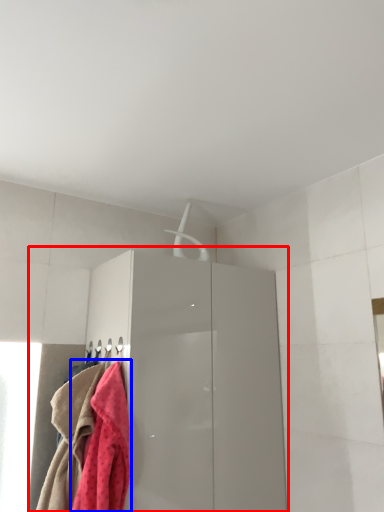
Question: Which object appears farthest to the camera in this image, dresser (highlighted by a red box) or towel (highlighted by a blue box)?

Choices:
 (A) dresser
 (B) towel

Answer: (A)